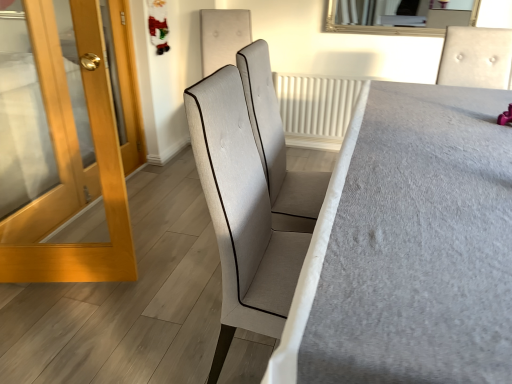
At what (x,y) coordinates should I click in order to perform the action: click on free spot in front of wooden glossy door at left. Please return your answer as a coordinate pair (x, y). Looking at the image, I should click on (55, 330).